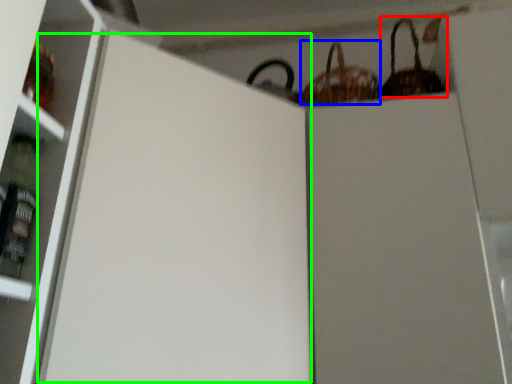
Question: Which object is the farthest from basket (highlighted by a red box)? Choose among these: basket (highlighted by a blue box) or screen door (highlighted by a green box).

Choices:
 (A) basket
 (B) screen door

Answer: (B)